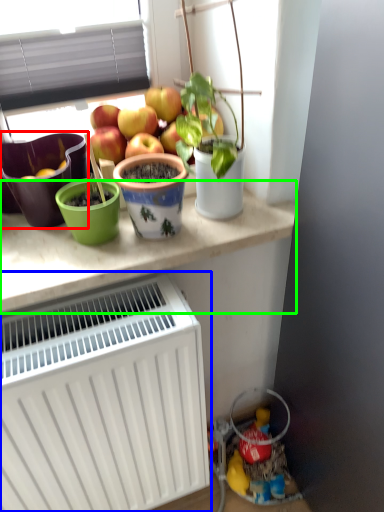
Question: Based on their relative distances, which object is farther from flowerpot (highlighted by a red box)? Choose from radiator (highlighted by a blue box) and table (highlighted by a green box).

Choices:
 (A) radiator
 (B) table

Answer: (A)